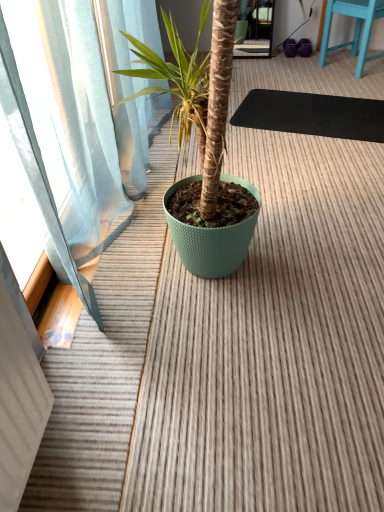
Question: Based on their positions, is blue painted wood chair at upper right located to the left or right of black rubber yoga mat at center?

Choices:
 (A) left
 (B) right

Answer: (B)

Question: Is blue painted wood chair at upper right taller or shorter than black rubber yoga mat at center?

Choices:
 (A) tall
 (B) short

Answer: (A)

Question: Considering the positions of blue painted wood chair at upper right and black rubber yoga mat at center in the image, is blue painted wood chair at upper right wider or thinner than black rubber yoga mat at center?

Choices:
 (A) thin
 (B) wide

Answer: (A)

Question: Is black rubber yoga mat at center in front of or behind blue painted wood chair at upper right in the image?

Choices:
 (A) front
 (B) behind

Answer: (A)

Question: Considering the positions of point (266, 126) and point (319, 53), is point (266, 126) closer or farther from the camera than point (319, 53)?

Choices:
 (A) closer
 (B) farther

Answer: (A)

Question: From their relative heights in the image, would you say black rubber yoga mat at center is taller or shorter than blue painted wood chair at upper right?

Choices:
 (A) short
 (B) tall

Answer: (A)

Question: In terms of size, does black rubber yoga mat at center appear bigger or smaller than blue painted wood chair at upper right?

Choices:
 (A) small
 (B) big

Answer: (A)